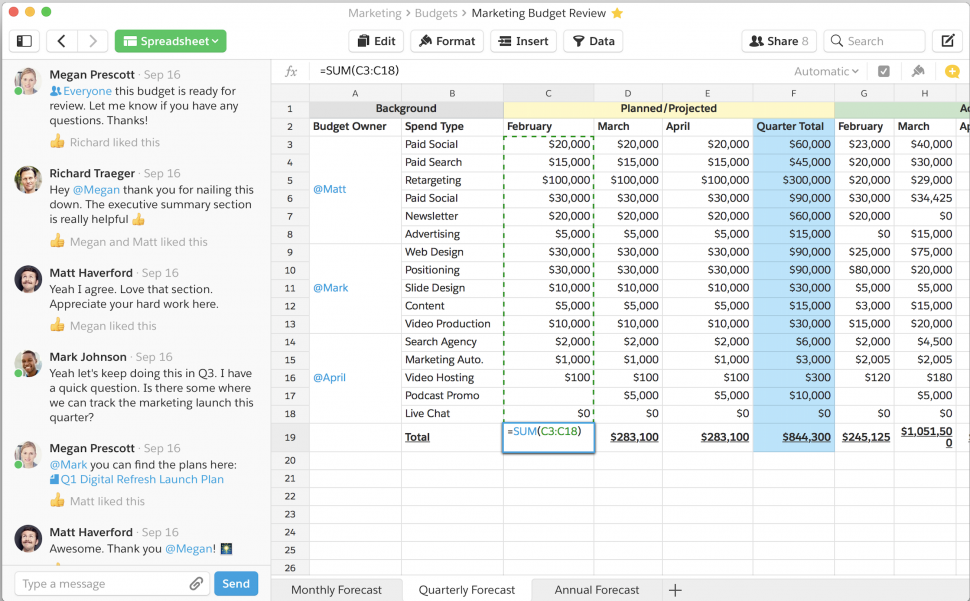
This screenshot has height=601, width=970. Identify the location of round picture. (26, 86), (22, 178), (23, 279), (20, 362), (24, 456), (24, 532).